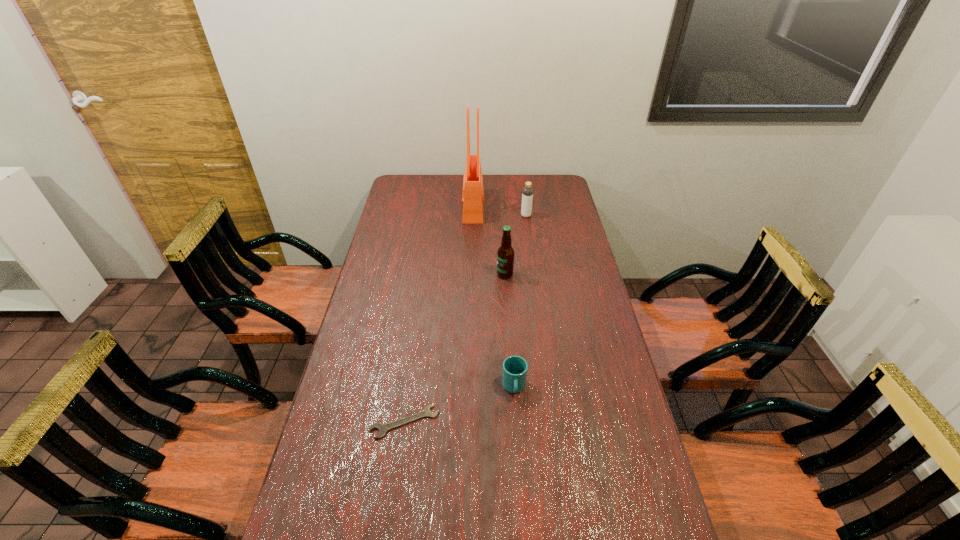
Find the location of a particular element. Image resolution: width=960 pixels, height=540 pixels. the second object from left to right is located at coordinates (473, 192).

This screenshot has width=960, height=540. In order to click on tote bag in this screenshot , I will do `click(473, 192)`.

Locate an element on the screen. This screenshot has width=960, height=540. the third nearest object is located at coordinates (505, 255).

You are a GUI agent. You are given a task and a screenshot of the screen. Output one action in this format:
    pyautogui.click(x=<x>, y=<y>)
    Task: Click on the fourth shortest object
    The width and height of the screenshot is (960, 540).
    Given the screenshot: What is the action you would take?
    pyautogui.click(x=505, y=255)

The image size is (960, 540). In order to click on bottle in this screenshot , I will do `click(527, 194)`.

At what (x,y) coordinates should I click in order to perform the action: click on the third tallest object. Please return your answer as a coordinate pair (x, y). This screenshot has width=960, height=540. Looking at the image, I should click on (527, 194).

Find the location of a particular element. the second nearest object is located at coordinates (514, 374).

Locate an element on the screen. This screenshot has width=960, height=540. cup is located at coordinates (514, 374).

Identify the location of wrench. The width and height of the screenshot is (960, 540). (382, 428).

Locate an element on the screen. This screenshot has height=540, width=960. the nearest object is located at coordinates (382, 428).